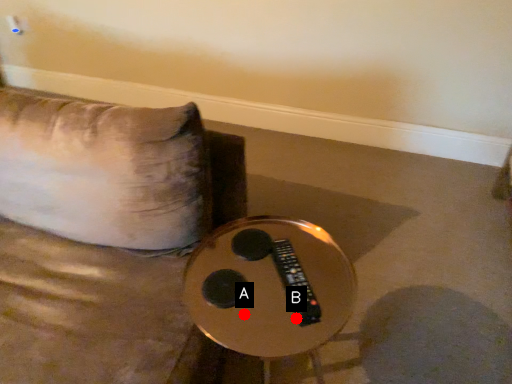
Question: Two points are circled on the image, labeled by A and B beside each circle. Among these points, which one is farthest from the camera?

Choices:
 (A) A is further
 (B) B is further

Answer: (B)